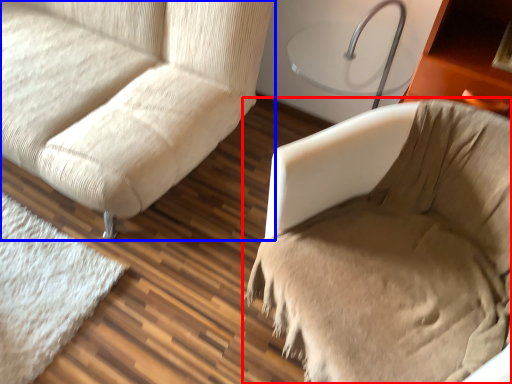
Question: Which of the following is the farthest to the observer, furniture (highlighted by a red box) or studio couch (highlighted by a blue box)?

Choices:
 (A) furniture
 (B) studio couch

Answer: (B)